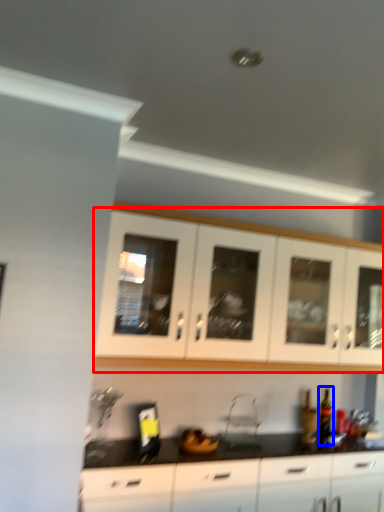
Question: Which object appears farthest to the camera in this image, cabinetry (highlighted by a red box) or bottle (highlighted by a blue box)?

Choices:
 (A) cabinetry
 (B) bottle

Answer: (B)